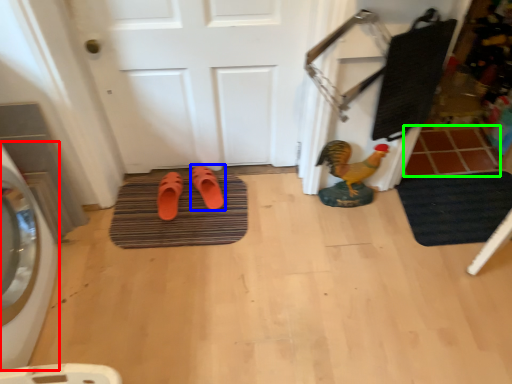
Question: Considering the real-world distances, which object is farthest from washing machine (highlighted by a red box)? footwear (highlighted by a blue box) or tile (highlighted by a green box)?

Choices:
 (A) footwear
 (B) tile

Answer: (B)